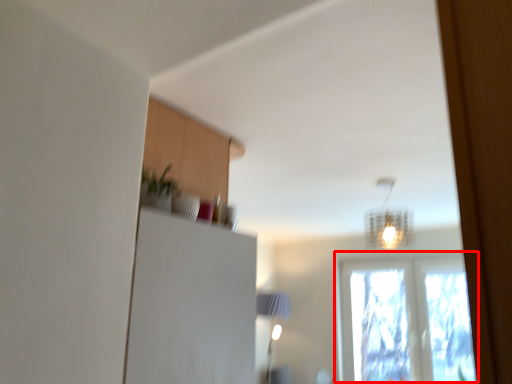
Question: From the image's perspective, what is the correct spatial positioning of window (annotated by the red box) in reference to lamp?

Choices:
 (A) above
 (B) below

Answer: (B)